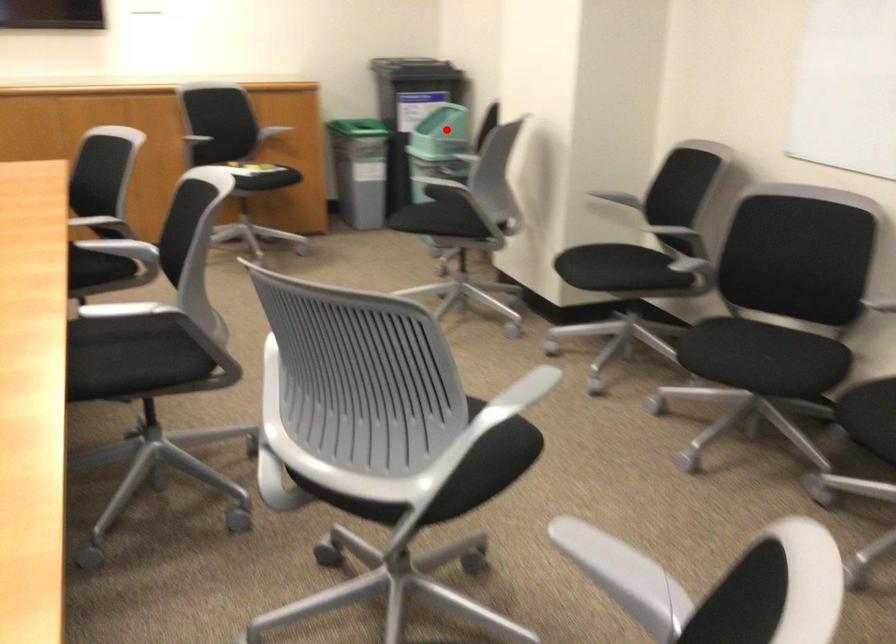
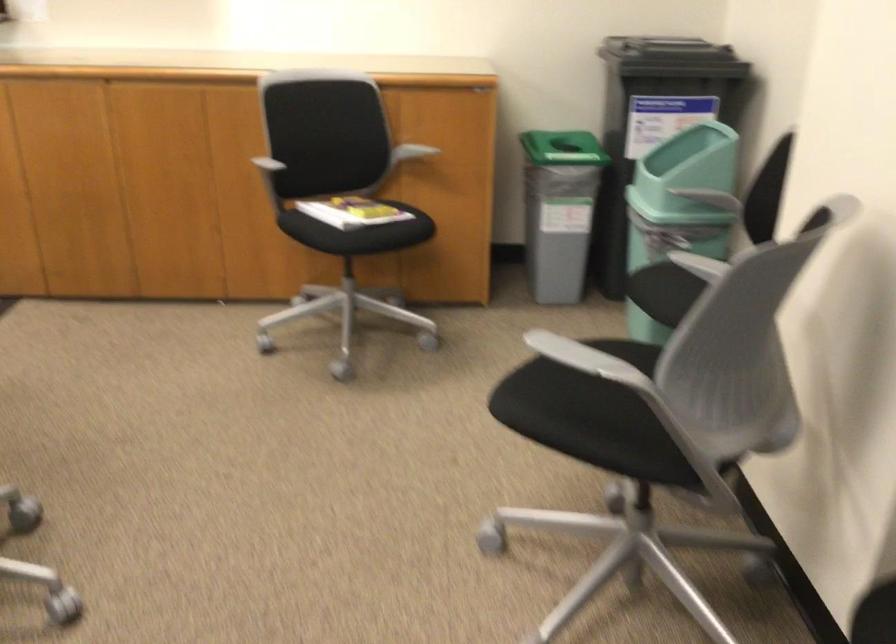
Question: I am providing you with two images of the same scene from different viewpoints. Image1 has a red point marked. In image2, the corresponding 3D location appears at what relative position? Reply with the corresponding letter.

Choices:
 (A) Closer
 (B) Farther

Answer: (A)